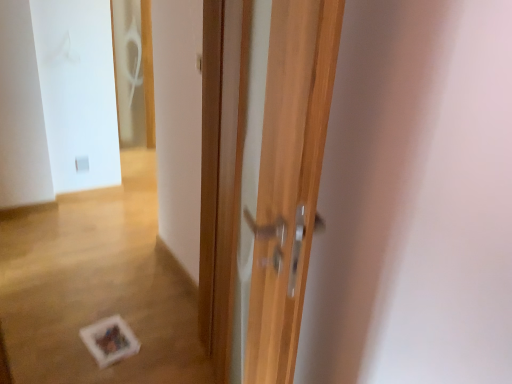
This screenshot has height=384, width=512. What do you see at coordinates (269, 180) in the screenshot? I see `wooden door at center` at bounding box center [269, 180].

Find the location of a particular element. The width and height of the screenshot is (512, 384). wooden door at center is located at coordinates (269, 180).

Measure the distance between wooden door at center and camera.

The depth of wooden door at center is 26.54 inches.

Image resolution: width=512 pixels, height=384 pixels. What are the coordinates of `wooden door at center` in the screenshot? It's located at (269, 180).